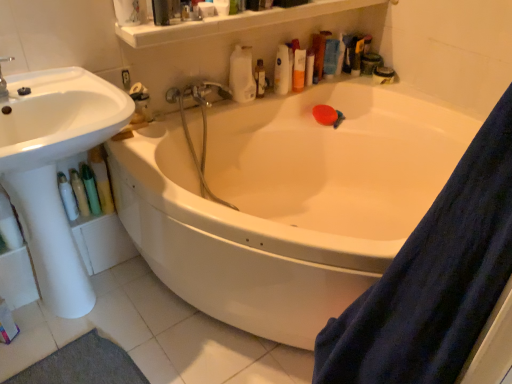
Question: Is translucent plastic bottle at upper right, which is the fifth toiletry in front-to-back order, aimed at metallic chrome faucet at upper center?

Choices:
 (A) yes
 (B) no

Answer: (B)

Question: Are translucent plastic bottle at upper right, which is the first toiletry in right-to-left order, and metallic chrome faucet at upper center located far from each other?

Choices:
 (A) no
 (B) yes

Answer: (A)

Question: Is translucent plastic bottle at upper right, which ranks as the 1th toiletry in back-to-front order, beside metallic chrome faucet at upper center?

Choices:
 (A) no
 (B) yes

Answer: (A)

Question: From the image's perspective, is translucent plastic bottle at upper right, arranged as the first toiletry when viewed from the top, under metallic chrome faucet at upper center?

Choices:
 (A) yes
 (B) no

Answer: (B)

Question: Considering the relative positions of translucent plastic bottle at upper right, arranged as the first toiletry when viewed from the top, and metallic chrome faucet at upper center in the image provided, is translucent plastic bottle at upper right, arranged as the first toiletry when viewed from the top, in front of metallic chrome faucet at upper center?

Choices:
 (A) yes
 (B) no

Answer: (B)

Question: From a real-world perspective, is translucent plastic bottle at upper right, acting as the fifth toiletry starting from the left, on metallic chrome faucet at upper center?

Choices:
 (A) yes
 (B) no

Answer: (A)

Question: Is white glossy sink at left at the left side of translucent plastic bottle at upper right, acting as the fifth toiletry starting from the left?

Choices:
 (A) no
 (B) yes

Answer: (B)

Question: Is white glossy sink at left outside translucent plastic bottle at upper right, arranged as the first toiletry when viewed from the top?

Choices:
 (A) yes
 (B) no

Answer: (A)

Question: Does white glossy sink at left contain translucent plastic bottle at upper right, which is the first toiletry in right-to-left order?

Choices:
 (A) no
 (B) yes

Answer: (A)

Question: Is white glossy sink at left in front of translucent plastic bottle at upper right, which ranks as the 1th toiletry in back-to-front order?

Choices:
 (A) yes
 (B) no

Answer: (A)

Question: Considering the relative sizes of white glossy sink at left and translucent plastic bottle at upper right, the fifth toiletry ordered from the bottom, in the image provided, is white glossy sink at left smaller than translucent plastic bottle at upper right, the fifth toiletry ordered from the bottom,?

Choices:
 (A) yes
 (B) no

Answer: (B)

Question: From the image's perspective, is white glossy sink at left under translucent plastic bottle at upper right, arranged as the first toiletry when viewed from the top?

Choices:
 (A) no
 (B) yes

Answer: (B)

Question: From a real-world perspective, is brushed metal faucet at upper left located beneath white glossy bathtub at center?

Choices:
 (A) yes
 (B) no

Answer: (B)